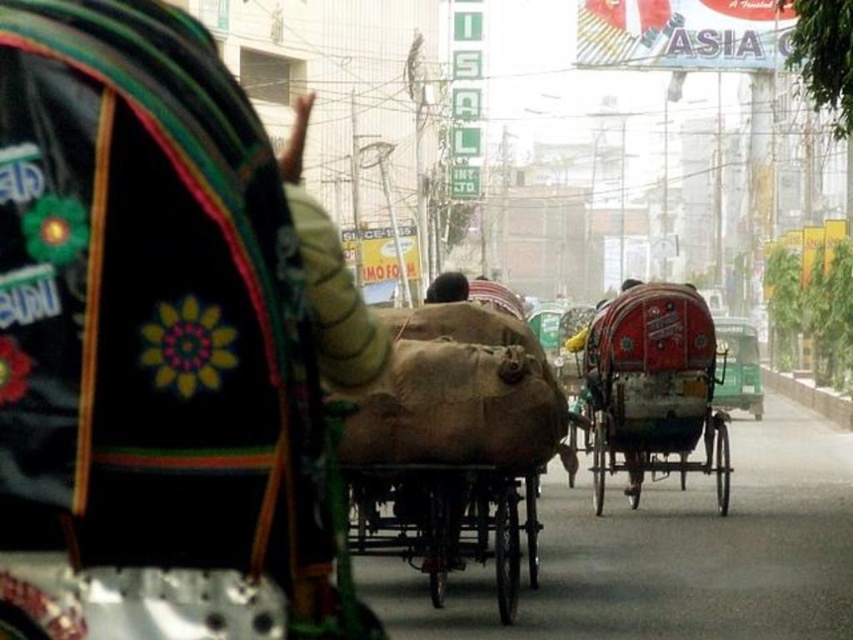
You are standing at the center of the street and want to find the red painted wood rickshaw at center. According to the coordinates given, in which direction should you look relative to your position?

The red painted wood rickshaw at center is located at coordinates point [653,387]. Since the coordinates are based on a standard image coordinate system where the origin is at the top left corner, the x increases to the right and y increases downward. Therefore, to locate the red painted wood rickshaw at center from the center of the street, you should look towards the lower right direction.